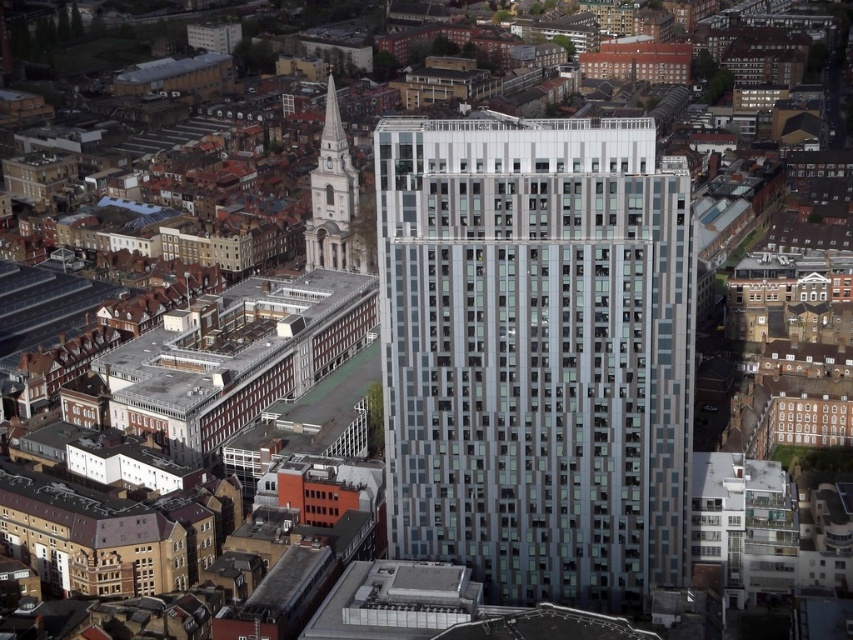
Question: Observing the image, what is the correct spatial positioning of silver glass building at center in reference to white stone tower at upper left?

Choices:
 (A) left
 (B) right

Answer: (B)

Question: Does silver glass building at center appear over white stone tower at upper left?

Choices:
 (A) yes
 (B) no

Answer: (B)

Question: Which point is closer to the camera?

Choices:
 (A) silver glass building at center
 (B) white stone tower at upper left

Answer: (A)

Question: Does silver glass building at center appear on the left side of white stone tower at upper left?

Choices:
 (A) no
 (B) yes

Answer: (A)